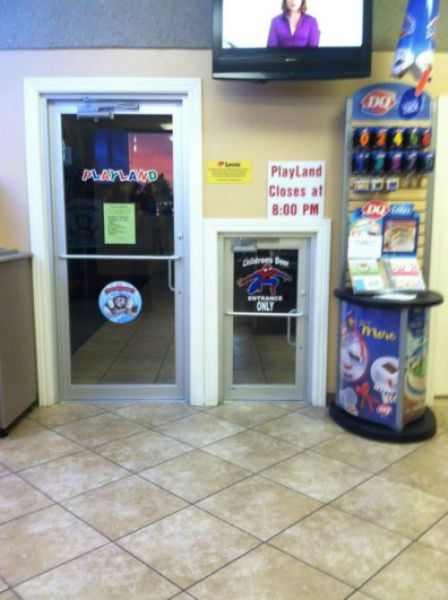
Where is `door handle`? This screenshot has width=448, height=600. door handle is located at coordinates click(x=286, y=332), click(x=168, y=276).